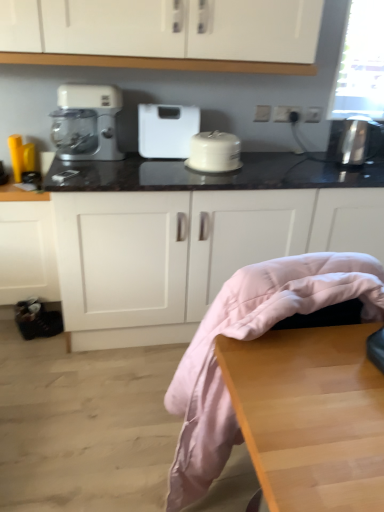
Question: Can you confirm if black marble countertop at center is shorter than white glossy cake stand at center?

Choices:
 (A) no
 (B) yes

Answer: (A)

Question: From the image's perspective, is black marble countertop at center on white glossy cake stand at center?

Choices:
 (A) no
 (B) yes

Answer: (A)

Question: Is the depth of black marble countertop at center greater than that of white glossy cake stand at center?

Choices:
 (A) yes
 (B) no

Answer: (B)

Question: Would you say black marble countertop at center is a long distance from white glossy cake stand at center?

Choices:
 (A) yes
 (B) no

Answer: (B)

Question: From the image's perspective, is black marble countertop at center beneath white glossy cake stand at center?

Choices:
 (A) no
 (B) yes

Answer: (B)

Question: From a real-world perspective, does black marble countertop at center stand above white glossy cake stand at center?

Choices:
 (A) no
 (B) yes

Answer: (A)

Question: Is white glossy cake stand at center next to wooden table at lower right?

Choices:
 (A) yes
 (B) no

Answer: (B)

Question: Is white glossy cake stand at center not within wooden table at lower right?

Choices:
 (A) no
 (B) yes

Answer: (B)

Question: From a real-world perspective, is white glossy cake stand at center physically below wooden table at lower right?

Choices:
 (A) yes
 (B) no

Answer: (B)

Question: Is white glossy cake stand at center to the right of wooden table at lower right from the viewer's perspective?

Choices:
 (A) yes
 (B) no

Answer: (B)

Question: From a real-world perspective, is white glossy cake stand at center on wooden table at lower right?

Choices:
 (A) yes
 (B) no

Answer: (A)

Question: Is white glossy cake stand at center bigger than wooden table at lower right?

Choices:
 (A) no
 (B) yes

Answer: (A)

Question: Does wooden table at lower right have a lesser height compared to white glossy cake stand at center?

Choices:
 (A) no
 (B) yes

Answer: (A)